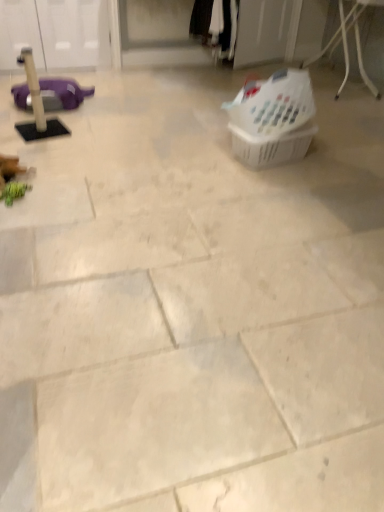
This screenshot has width=384, height=512. Find the location of `metallic wire basket at upper right`. metallic wire basket at upper right is located at coordinates (356, 42).

Consider the image. What is the approximate height of translucent plastic basket at center-right, the second basket viewed from the top?

The height of translucent plastic basket at center-right, the second basket viewed from the top, is 9.47 inches.

Locate an element on the screen. The width and height of the screenshot is (384, 512). black cotton pants at upper center is located at coordinates (201, 20).

Is point (355, 17) less distant than point (234, 106)?

No, it is not.

How distant is metallic wire basket at upper right from white plastic laundry basket at upper right, the first basket viewed from the top?

They are 1.75 meters apart.

Is metallic wire basket at upper right facing away from white plastic laundry basket at upper right, acting as the 2th basket starting from the bottom?

That's not correct — metallic wire basket at upper right is not looking away from white plastic laundry basket at upper right, acting as the 2th basket starting from the bottom.

Can white plastic laundry basket at upper right, the first basket viewed from the top, be found inside metallic wire basket at upper right?

No, white plastic laundry basket at upper right, the first basket viewed from the top, is not a part of metallic wire basket at upper right.

Who is smaller, white plastic laundry basket at upper right, the first basket viewed from the top, or black cotton pants at upper center?

white plastic laundry basket at upper right, the first basket viewed from the top.

Can you confirm if white plastic laundry basket at upper right, the first basket viewed from the top, is shorter than black cotton pants at upper center?

Indeed, white plastic laundry basket at upper right, the first basket viewed from the top, has a lesser height compared to black cotton pants at upper center.

Is black cotton pants at upper center completely or partially inside white plastic laundry basket at upper right, acting as the 2th basket starting from the bottom?

Actually, black cotton pants at upper center is outside white plastic laundry basket at upper right, acting as the 2th basket starting from the bottom.

Image resolution: width=384 pixels, height=512 pixels. There is a black cotton pants at upper center. In order to click on the 1st basket below it (from a real-world perspective) in this screenshot , I will do `click(272, 119)`.

Can you confirm if metallic wire basket at upper right is smaller than translucent plastic basket at center-right, the first basket ordered from the bottom?

No.

Considering the relative sizes of metallic wire basket at upper right and translucent plastic basket at center-right, the first basket ordered from the bottom, in the image provided, is metallic wire basket at upper right thinner than translucent plastic basket at center-right, the first basket ordered from the bottom,?

No, metallic wire basket at upper right is not thinner than translucent plastic basket at center-right, the first basket ordered from the bottom.

Would you consider metallic wire basket at upper right to be distant from translucent plastic basket at center-right, the second basket viewed from the top?

metallic wire basket at upper right is positioned a significant distance from translucent plastic basket at center-right, the second basket viewed from the top.

Considering the sizes of objects metallic wire basket at upper right and translucent plastic basket at center-right, the first basket ordered from the bottom, in the image provided, who is shorter, metallic wire basket at upper right or translucent plastic basket at center-right, the first basket ordered from the bottom,?

translucent plastic basket at center-right, the first basket ordered from the bottom, is shorter.

Does point (262, 116) come in front of point (358, 2)?

Yes, point (262, 116) is closer to viewer.

Can you confirm if white plastic laundry basket at upper right, the first basket viewed from the top, is positioned to the right of metallic wire basket at upper right?

No, white plastic laundry basket at upper right, the first basket viewed from the top, is not to the right of metallic wire basket at upper right.

Is white plastic laundry basket at upper right, acting as the 2th basket starting from the bottom, aimed at metallic wire basket at upper right?

No, white plastic laundry basket at upper right, acting as the 2th basket starting from the bottom, is not aimed at metallic wire basket at upper right.

From the picture: Are white plastic laundry basket at upper right, acting as the 2th basket starting from the bottom, and metallic wire basket at upper right beside each other?

They are not placed beside each other.

In the scene shown: How different are the orientations of translucent plastic basket at center-right, the first basket ordered from the bottom, and black cotton pants at upper center in degrees?

They differ by 11.5 degrees in their facing directions.

Based on the photo, which is more to the right, translucent plastic basket at center-right, the first basket ordered from the bottom, or black cotton pants at upper center?

From the viewer's perspective, translucent plastic basket at center-right, the first basket ordered from the bottom, appears more on the right side.

Is translucent plastic basket at center-right, the first basket ordered from the bottom, completely or partially outside of black cotton pants at upper center?

Yes, translucent plastic basket at center-right, the first basket ordered from the bottom, is outside of black cotton pants at upper center.

Considering the positions of objects metallic wire basket at upper right and black cotton pants at upper center in the image provided, who is more to the left, metallic wire basket at upper right or black cotton pants at upper center?

black cotton pants at upper center is more to the left.

Looking at the image, does metallic wire basket at upper right seem bigger or smaller compared to black cotton pants at upper center?

metallic wire basket at upper right is bigger than black cotton pants at upper center.

Which is in front, metallic wire basket at upper right or black cotton pants at upper center?

metallic wire basket at upper right is closer to the camera.

Does metallic wire basket at upper right turn towards black cotton pants at upper center?

Yes.

From the image's perspective, is translucent plastic basket at center-right, the second basket viewed from the top, on top of metallic wire basket at upper right?

Actually, translucent plastic basket at center-right, the second basket viewed from the top, appears below metallic wire basket at upper right in the image.

From the picture: Can you tell me how much translucent plastic basket at center-right, the second basket viewed from the top, and metallic wire basket at upper right differ in facing direction?

97.7 degrees separate the facing orientations of translucent plastic basket at center-right, the second basket viewed from the top, and metallic wire basket at upper right.

Does point (284, 154) appear closer or farther from the camera than point (370, 81)?

Point (284, 154) is positioned closer to the camera compared to point (370, 81).

From a real-world perspective, is translucent plastic basket at center-right, the first basket ordered from the bottom, beneath metallic wire basket at upper right?

Yes.

Find the location of a particular element. furniture on the right of white plastic laundry basket at upper right, acting as the 2th basket starting from the bottom is located at coordinates (356, 42).

Identify the location of clothing behind the white plastic laundry basket at upper right, acting as the 2th basket starting from the bottom. The height and width of the screenshot is (512, 384). (201, 20).

Based on their spatial positions, is white plastic laundry basket at upper right, acting as the 2th basket starting from the bottom, or black cotton pants at upper center further from translucent plastic basket at center-right, the second basket viewed from the top?

black cotton pants at upper center lies further to translucent plastic basket at center-right, the second basket viewed from the top, than the other object.

Based on the photo, from the image, which object appears to be nearer to black cotton pants at upper center, white plastic laundry basket at upper right, acting as the 2th basket starting from the bottom, or translucent plastic basket at center-right, the first basket ordered from the bottom?

white plastic laundry basket at upper right, acting as the 2th basket starting from the bottom, is positioned closer to the anchor black cotton pants at upper center.

Which object lies further to the anchor point metallic wire basket at upper right, black cotton pants at upper center or translucent plastic basket at center-right, the second basket viewed from the top?

translucent plastic basket at center-right, the second basket viewed from the top, lies further to metallic wire basket at upper right than the other object.

When comparing their distances from metallic wire basket at upper right, does translucent plastic basket at center-right, the second basket viewed from the top, or white plastic laundry basket at upper right, the first basket viewed from the top, seem closer?

Based on the image, white plastic laundry basket at upper right, the first basket viewed from the top, appears to be nearer to metallic wire basket at upper right.

In the scene shown: From the image, which object appears to be nearer to white plastic laundry basket at upper right, acting as the 2th basket starting from the bottom, metallic wire basket at upper right or black cotton pants at upper center?

Among the two, metallic wire basket at upper right is located nearer to white plastic laundry basket at upper right, acting as the 2th basket starting from the bottom.

Looking at the image, which one is located further to black cotton pants at upper center, translucent plastic basket at center-right, the first basket ordered from the bottom, or white plastic laundry basket at upper right, the first basket viewed from the top?

translucent plastic basket at center-right, the first basket ordered from the bottom.

When comparing their distances from metallic wire basket at upper right, does translucent plastic basket at center-right, the second basket viewed from the top, or black cotton pants at upper center seem further?

translucent plastic basket at center-right, the second basket viewed from the top, lies further to metallic wire basket at upper right than the other object.

Which object lies further to the anchor point black cotton pants at upper center, white plastic laundry basket at upper right, the first basket viewed from the top, or metallic wire basket at upper right?

The object further to black cotton pants at upper center is white plastic laundry basket at upper right, the first basket viewed from the top.

Where is `basket positioned between white plastic laundry basket at upper right, acting as the 2th basket starting from the bottom, and black cotton pants at upper center from near to far`? The image size is (384, 512). basket positioned between white plastic laundry basket at upper right, acting as the 2th basket starting from the bottom, and black cotton pants at upper center from near to far is located at coordinates (271, 147).

The height and width of the screenshot is (512, 384). I want to click on basket between white plastic laundry basket at upper right, acting as the 2th basket starting from the bottom, and metallic wire basket at upper right, in the horizontal direction, so click(271, 147).